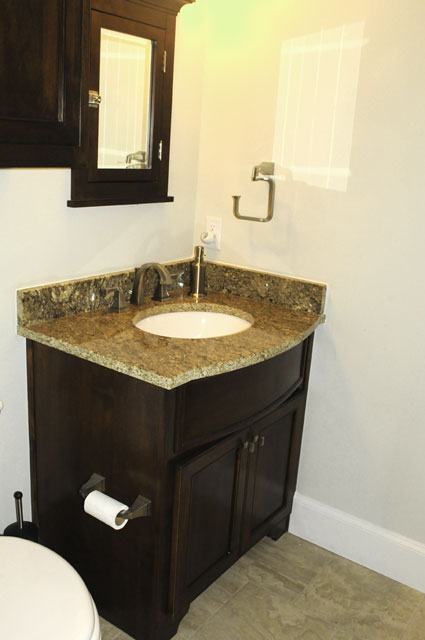
I want to click on toilet seat, so click(x=97, y=630).